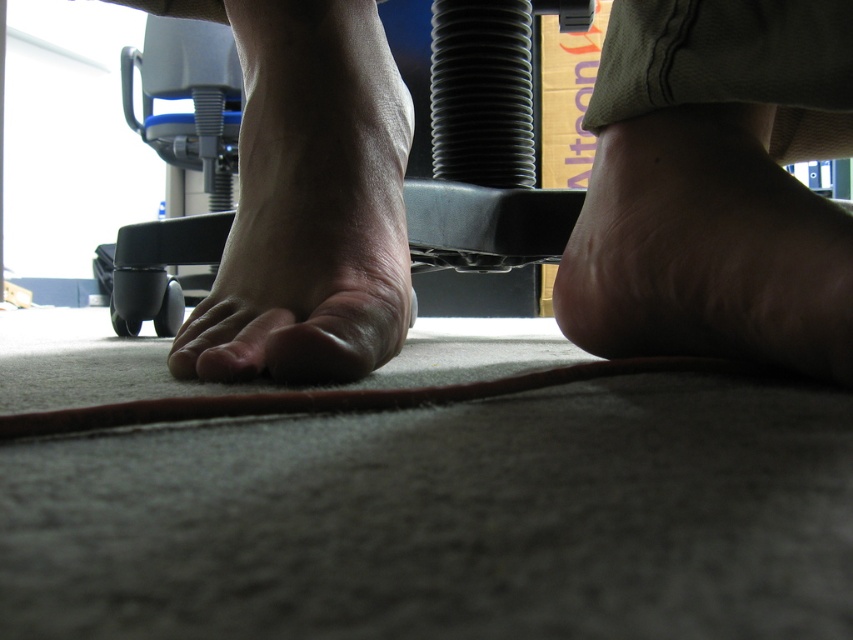
You are trying to locate the black plastic chair at center in the image. According to the coordinates provided, where exactly is it positioned?

The black plastic chair at center is located at the coordinates point [486,141].

You are a delivery robot with a 6 inch wide package. You need to move from the office chair to the desk while avoiding the coiled black cable. Can you fit between the skinny barefoot at lower left and the matte skin toe at center?

The distance between the skinny barefoot at lower left and the matte skin toe at center is 5.65 inches, which is slightly less than the 6 inch width of the package. Therefore, the package cannot fit through that space.

You are trying to reach a toy that is placed near the desk in the background. You notice the skinny barefoot at lower left and the coiled black cable near the feet. Based on their positions, which object is closer to you?

The skinny barefoot at lower left is closer to you because it is positioned at point (315,195) which is closer to the viewer compared to the coiled black cable that is placed further back.